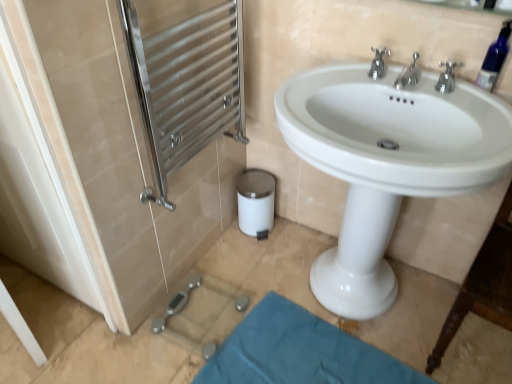
Locate an element on the screen. free space in front of polished chrome faucet at upper center, the third tap when ordered from right to left is located at coordinates (403, 94).